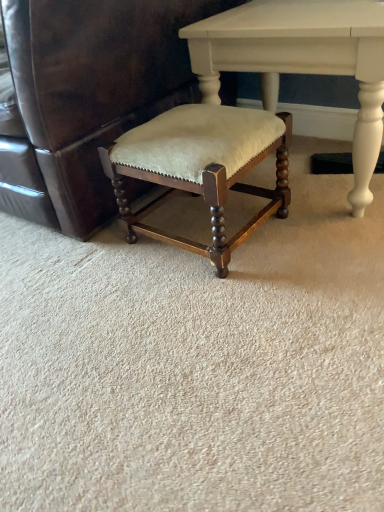
Question: Considering the relative positions of matte white table at center and velvet beige cushioned stool at center in the image provided, is matte white table at center to the left or to the right of velvet beige cushioned stool at center?

Choices:
 (A) right
 (B) left

Answer: (A)

Question: Considering the positions of matte white table at center and velvet beige cushioned stool at center in the image, is matte white table at center bigger or smaller than velvet beige cushioned stool at center?

Choices:
 (A) big
 (B) small

Answer: (B)

Question: Estimate the real-world distances between objects in this image. Which object is closer to the velvet beige cushioned stool at center?

Choices:
 (A) velvet beige stool at center
 (B) matte white table at center

Answer: (A)

Question: Estimate the real-world distances between objects in this image. Which object is farther from the velvet beige stool at center?

Choices:
 (A) matte white table at center
 (B) velvet beige cushioned stool at center

Answer: (A)